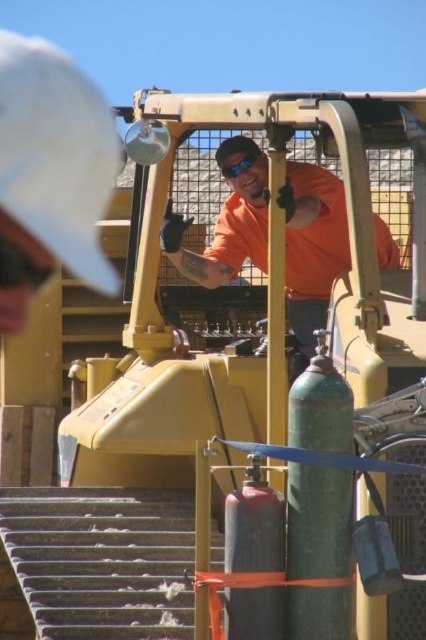
Question: In this image, where is white fabric cap at upper left located relative to orange fabric shirt at center?

Choices:
 (A) left
 (B) right

Answer: (A)

Question: Which object appears farthest from the camera in this image?

Choices:
 (A) white fabric cap at upper left
 (B) orange fabric shirt at center

Answer: (A)

Question: From the image, what is the correct spatial relationship of white fabric cap at upper left in relation to orange fabric shirt at center?

Choices:
 (A) right
 (B) left

Answer: (B)

Question: Which point is closer to the camera taking this photo?

Choices:
 (A) (13, 205)
 (B) (330, 276)

Answer: (B)

Question: Which point is farther to the camera?

Choices:
 (A) (8, 180)
 (B) (379, 262)

Answer: (A)

Question: Is white fabric cap at upper left to the right of orange fabric shirt at center from the viewer's perspective?

Choices:
 (A) yes
 (B) no

Answer: (B)